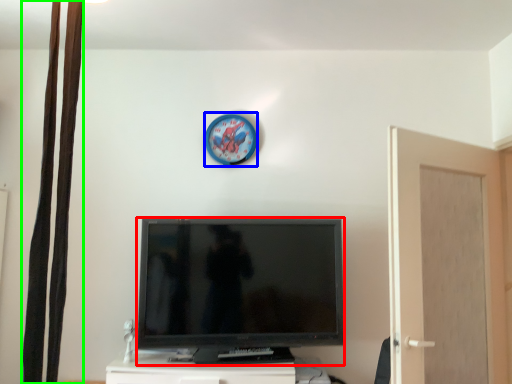
Question: Considering the real-world distances, which object is farthest from television (highlighted by a red box)? clock (highlighted by a blue box) or curtain (highlighted by a green box)?

Choices:
 (A) clock
 (B) curtain

Answer: (B)